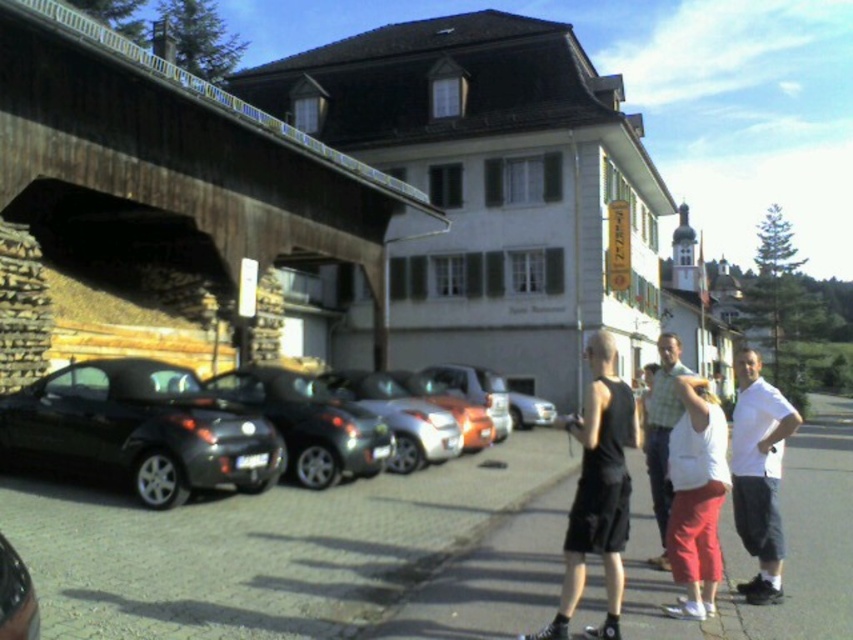
You are standing at the point marked as point (x=206, y=429) in the image. What object is located exactly at your current position?

The shiny black convertible at center is located exactly at point (x=206, y=429).

You are standing on the street in front of the building with the yellow sign. You see two points marked in the scene. The first point is at coordinate (107, 74) and the second point is at (521, 602). Which point is closer to you?

Point (107, 74) is closer to you because it is further to the viewer than point (521, 602).